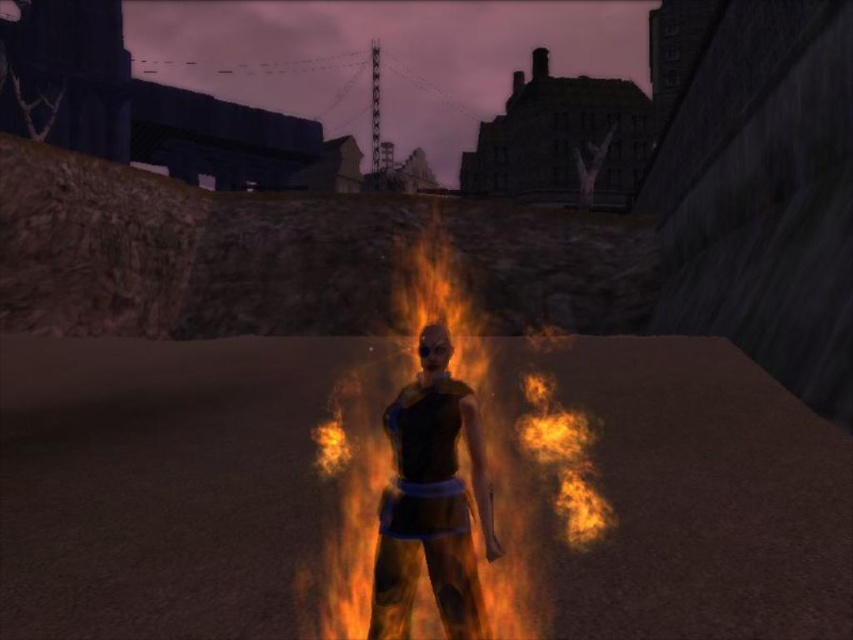
Question: Which point is farther to the camera?

Choices:
 (A) shiny black armor at center
 (B) flaming orange flames at center

Answer: (B)

Question: Can you confirm if flaming orange flames at center is thinner than shiny black armor at center?

Choices:
 (A) yes
 (B) no

Answer: (B)

Question: Which object appears farthest from the camera in this image?

Choices:
 (A) flaming orange flames at center
 (B) shiny black armor at center

Answer: (A)

Question: Which point is closer to the camera?

Choices:
 (A) (421, 522)
 (B) (432, 566)

Answer: (B)

Question: Is flaming orange flames at center behind shiny black armor at center?

Choices:
 (A) yes
 (B) no

Answer: (A)

Question: In this image, where is flaming orange flames at center located relative to shiny black armor at center?

Choices:
 (A) left
 (B) right

Answer: (B)